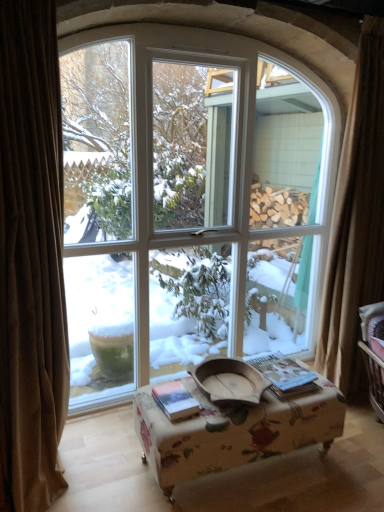
Locate an element on the screen. free space behind brown velvet curtain at left, positioned as the first curtain in left-to-right order is located at coordinates (94, 433).